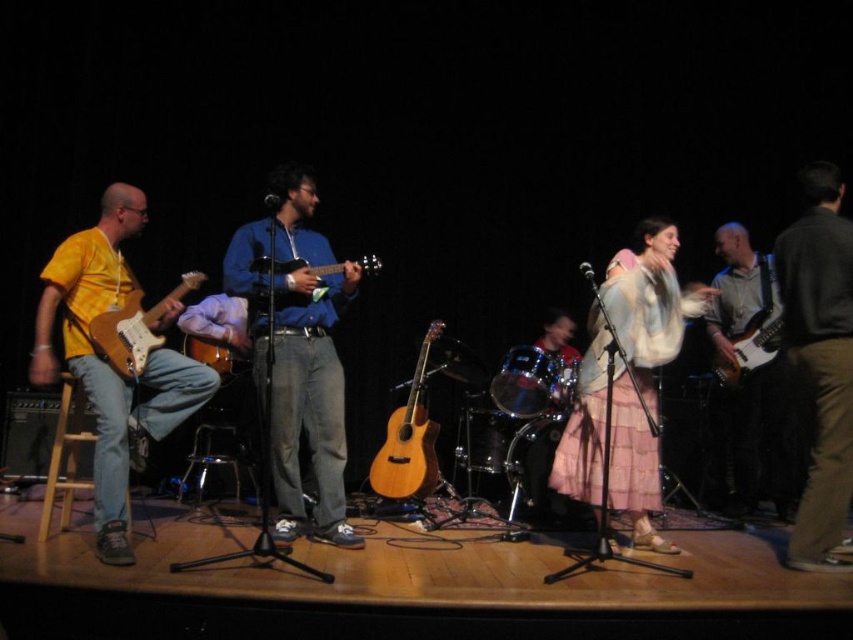
Can you confirm if matte yellow electric guitar at left is thinner than matte brown acoustic guitar at left?

Correct, matte yellow electric guitar at left's width is less than matte brown acoustic guitar at left's.

Who is more forward, (140, 342) or (229, 346)?

Point (140, 342)

Is point (119, 340) farther from viewer compared to point (212, 362)?

No, (119, 340) is closer to viewer.

Image resolution: width=853 pixels, height=640 pixels. I want to click on matte yellow electric guitar at left, so click(x=134, y=328).

Is brown glossy electric guitar at right to the left of wooden acoustic guitar at center from the viewer's perspective?

No, brown glossy electric guitar at right is not to the left of wooden acoustic guitar at center.

Does brown glossy electric guitar at right have a smaller size compared to wooden acoustic guitar at center?

No.

This screenshot has width=853, height=640. Describe the element at coordinates (749, 442) in the screenshot. I see `brown glossy electric guitar at right` at that location.

This screenshot has width=853, height=640. What are the coordinates of `brown glossy electric guitar at right` in the screenshot? It's located at (749, 442).

The image size is (853, 640). What do you see at coordinates (109, 365) in the screenshot? I see `yellow matte guitar at left` at bounding box center [109, 365].

Between yellow matte guitar at left and natural wood acoustic guitar at center, which one appears on the right side from the viewer's perspective?

natural wood acoustic guitar at center is more to the right.

This screenshot has height=640, width=853. What do you see at coordinates (109, 365) in the screenshot?
I see `yellow matte guitar at left` at bounding box center [109, 365].

The image size is (853, 640). I want to click on yellow matte guitar at left, so click(109, 365).